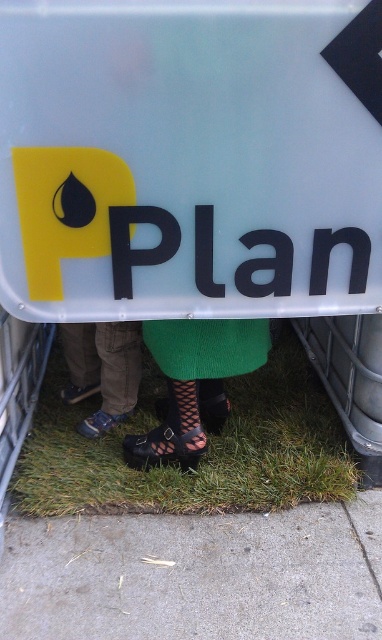
Image resolution: width=382 pixels, height=640 pixels. Find the location of `green grass at lower center`. green grass at lower center is located at coordinates (205, 456).

Is green grass at lower center in front of black leather shoes at center?

No, green grass at lower center is further to the viewer.

Is point (296, 364) less distant than point (197, 460)?

No.

Image resolution: width=382 pixels, height=640 pixels. Identify the location of green grass at lower center. (205, 456).

From the picture: Does matte plastic sign at upper center appear on the left side of brown suede shoes at lower left?

No, matte plastic sign at upper center is not to the left of brown suede shoes at lower left.

How much distance is there between matte plastic sign at upper center and brown suede shoes at lower left?

They are 30.43 inches apart.

The image size is (382, 640). What do you see at coordinates (189, 157) in the screenshot?
I see `matte plastic sign at upper center` at bounding box center [189, 157].

Where is `matte plastic sign at upper center`? matte plastic sign at upper center is located at coordinates (189, 157).

Which of these two, green grass at lower center or brown suede shoes at lower left, stands taller?

green grass at lower center

What do you see at coordinates (205, 456) in the screenshot?
I see `green grass at lower center` at bounding box center [205, 456].

This screenshot has width=382, height=640. What are the coordinates of `green grass at lower center` in the screenshot? It's located at (205, 456).